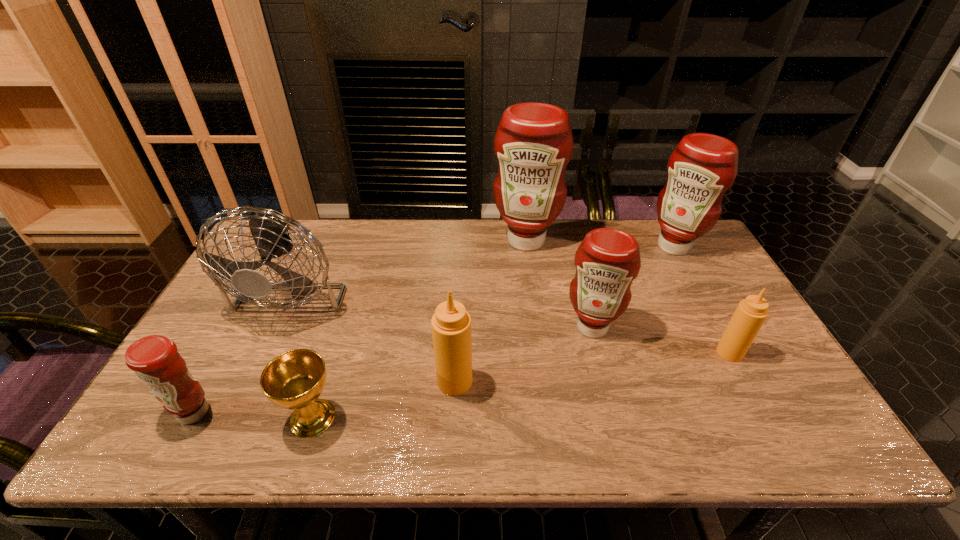
I want to click on free space located 0.100m on the back of the farther tan condiment, so click(x=709, y=316).

You are a GUI agent. You are given a task and a screenshot of the screen. Output one action in this format:
    pyautogui.click(x=<x>, y=<y>)
    Task: Click on the vacant space located on the right of the leftmost red condiment
    The image size is (960, 540).
    Given the screenshot: What is the action you would take?
    pyautogui.click(x=326, y=413)

I want to click on free space located on the right of the chalice, so click(498, 418).

Image resolution: width=960 pixels, height=540 pixels. I want to click on fan positioned at the far edge, so click(269, 233).

I want to click on condiment that is positioned at the near edge, so click(155, 360).

Where is `chalice present at the near edge`? The height and width of the screenshot is (540, 960). chalice present at the near edge is located at coordinates (294, 380).

Where is `fan positioned at the left edge`? The width and height of the screenshot is (960, 540). fan positioned at the left edge is located at coordinates (269, 233).

You are a GUI agent. You are given a task and a screenshot of the screen. Output one action in this format:
    pyautogui.click(x=<x>, y=<y>)
    Task: Click on the condiment that is at the left edge
    
    Given the screenshot: What is the action you would take?
    pyautogui.click(x=155, y=360)

The width and height of the screenshot is (960, 540). In order to click on object that is at the far left corner in this screenshot , I will do `click(269, 233)`.

Where is `object at the near left corner`? The image size is (960, 540). object at the near left corner is located at coordinates (155, 360).